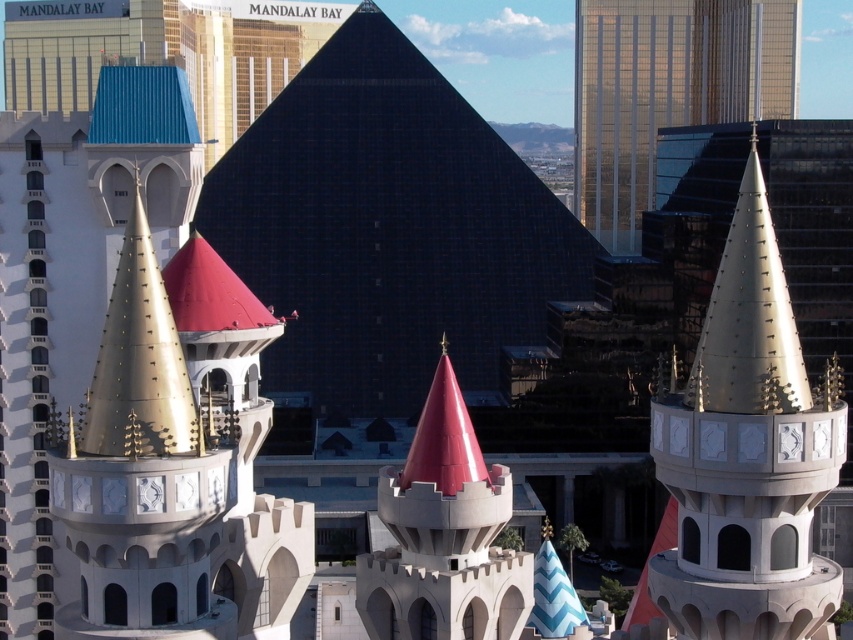
You are a tourist standing in front of the black glass pyramid at center and the gold metallic spire at left. Which structure would you need to look up at more to see the top?

The black glass pyramid at center is much taller than the gold metallic spire at left, so you would need to look up more to see the top of the black glass pyramid at center.

You are a drone operator tasked with capturing aerial footage of the gold metallic spire at center. The drone must maintain a safe distance from the spire to avoid collisions. Given that the drone is currently at coordinates point A, which is 0.6 units away from the spire in the x and y directions, can you determine if the drone is positioned safely to the north or south of the spire?

The gold metallic spire at center is located at point coordinates. The drone is at point A, which is 0.6 units away in both the x and y directions. To determine the direction, we need to know the coordinate system orientation. Typically, in such systems, increasing y might indicate north. However, without explicit coordinate system details, we can only state the distance. The question asks about direction, which cannot be conclusively answered with the provided information.